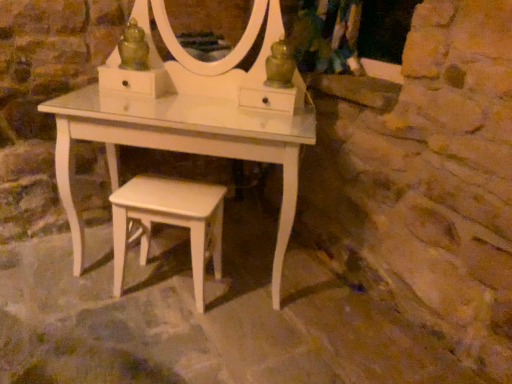
The width and height of the screenshot is (512, 384). Find the location of `free area behind white matte stool at center`. free area behind white matte stool at center is located at coordinates point(183,256).